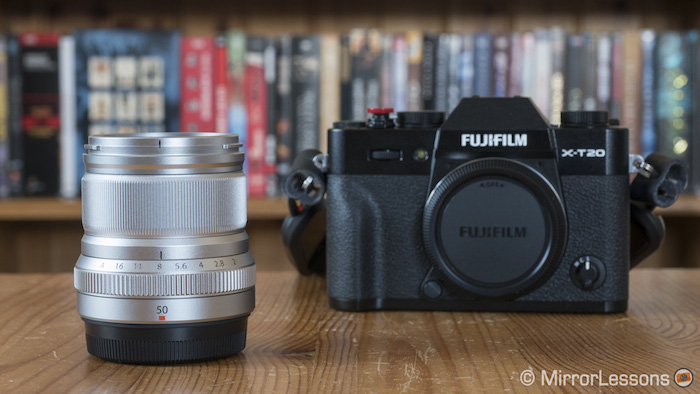
The height and width of the screenshot is (394, 700). Find the location of `shelf`. shelf is located at coordinates (32, 207), (269, 210).